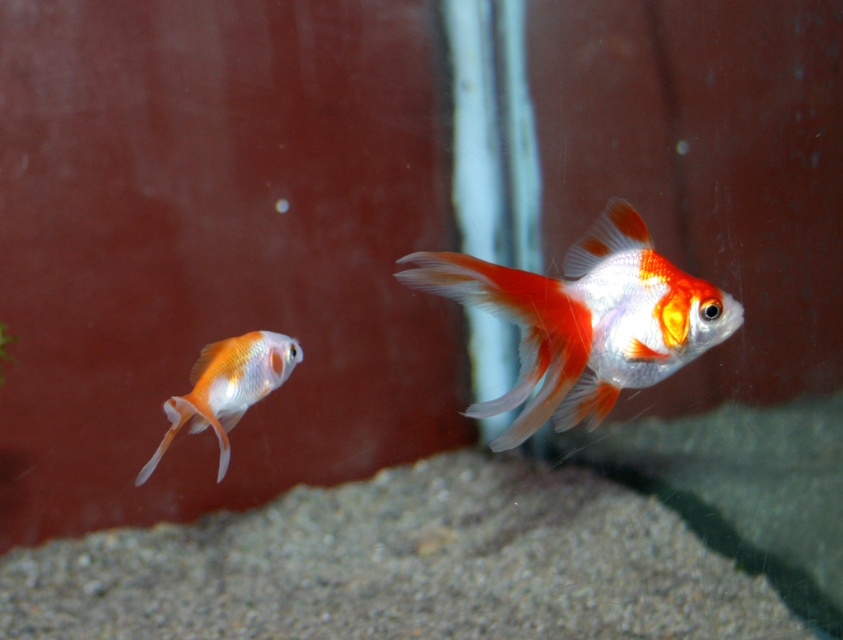
Looking at this image, you are a goldfish in the tank and want to swim to the nearest point between point (578,410) and point (208,406). Which point should you swim to?

You should swim to point (578,410) because it is closer to the viewer than point (208,406).

You are a new goldfish in the tank and want to swim to the shiny orange and white goldfish at center. Which direction should you swim to reach it from the matte orange goldfish at left?

The shiny orange and white goldfish at center is located above the matte orange goldfish at left, so you should swim upward to reach it.

You are a photographer standing 1 meter away from a fish tank. You want to take a closeup photo of the shiny orange and white goldfish at center. Can you get a clear closeup shot without moving closer than your current position?

The shiny orange and white goldfish at center and camera are 1.01 meters apart from each other. Since you are currently 1 meter away, you need to move slightly closer to reach the 1.01 meter distance required for the closeup shot.